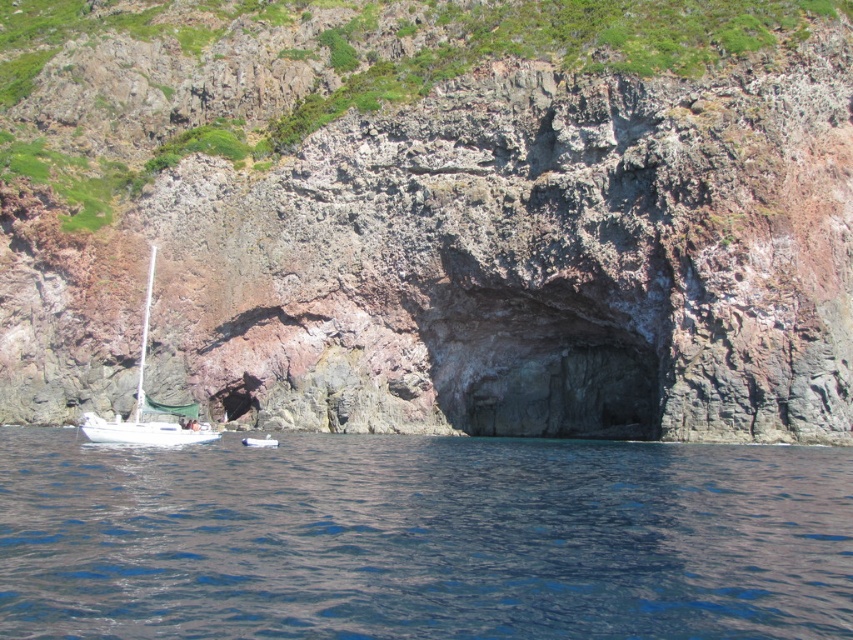
You are a photographer planning to capture the rusty rock cliff at center and the white matte boat at lower left in a single shot. Based on their sizes in the scene, which object will occupy more of the frame?

The rusty rock cliff at center is much taller than the white matte boat at lower left, so it will occupy more of the frame.

You are a photographer planning to capture the entire view of the rusty rock cliff at center and the white matte sailboat at lower left in a single frame. Based on their sizes, which object will occupy more of the photo frame?

The rusty rock cliff at center will occupy more of the photo frame since its width surpasses that of the white matte sailboat at lower left.